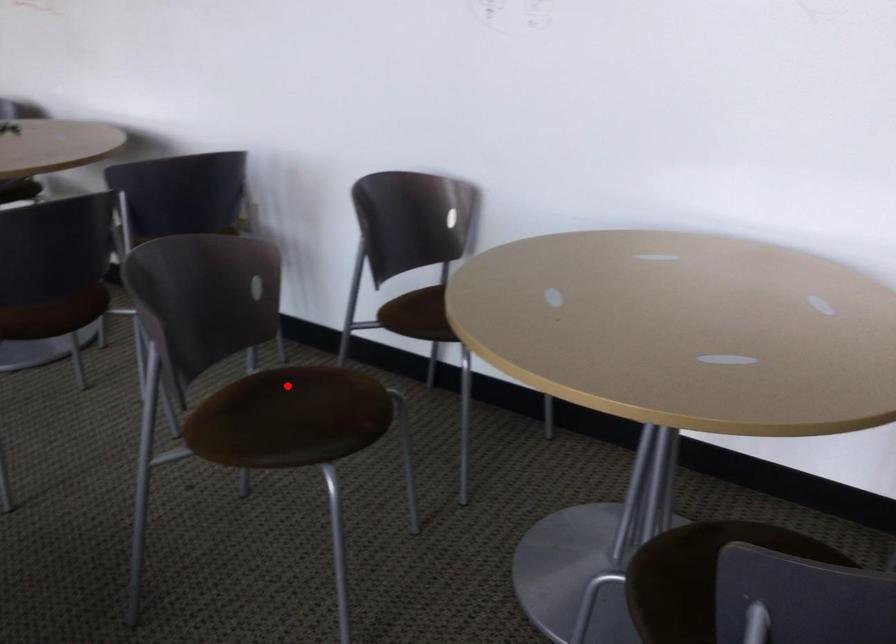
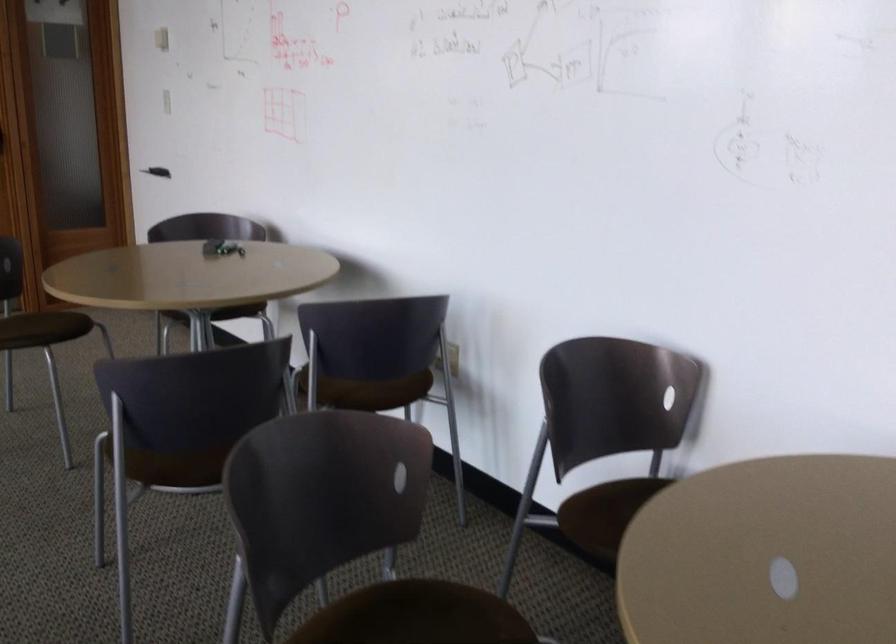
Question: A red point is marked in image1. In image2, is the corresponding 3D point closer to the camera or farther? Reply with the corresponding letter.

Choices:
 (A) The corresponding 3D point is closer.
 (B) The corresponding 3D point is farther.

Answer: (A)